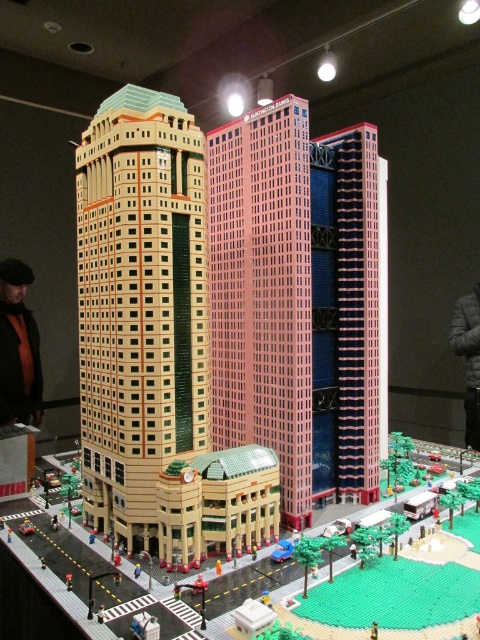
From the picture: You are a delivery drone that needs to fly from the beige brick building at center to the pink plastic building at center. Which direction should you fly to reach your destination?

The beige brick building at center is positioned on the left side of the pink plastic building at center, so you should fly to the right to reach the pink plastic building at center.

You are a drone operator tasked with capturing aerial footage of the Lego cityscape. You need to fly your drone from the left building to the middle building. Which direction should you fly to reach the pink plastic building at center from the left building?

The pink plastic building at center is located at point (263, 291), so you should fly towards the center of the image to reach it from the left building.